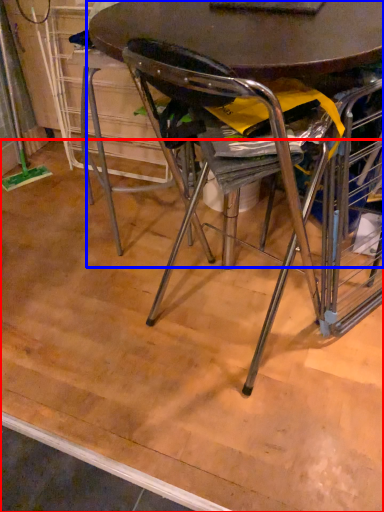
Question: Which point is further to the camera, plywood (highlighted by a red box) or table (highlighted by a blue box)?

Choices:
 (A) plywood
 (B) table

Answer: (A)